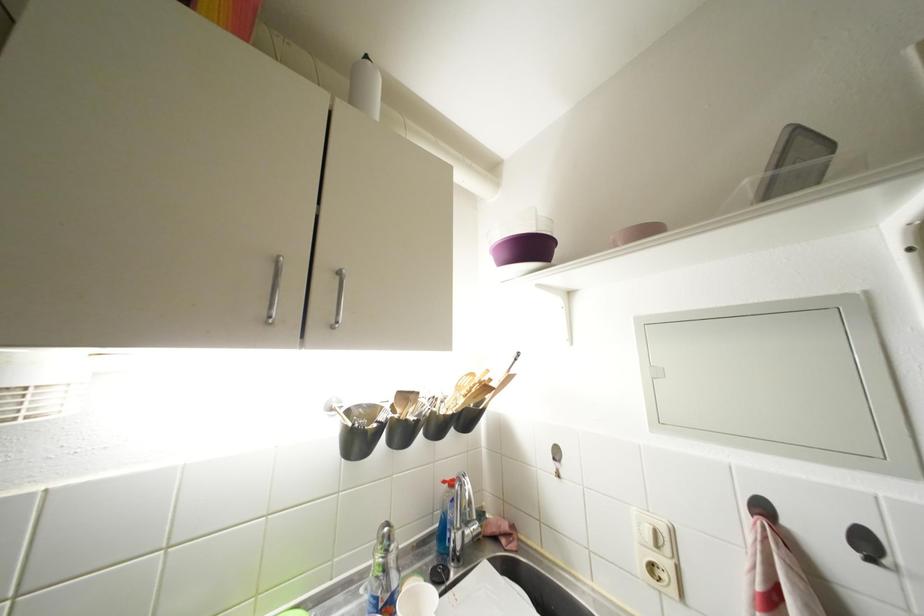
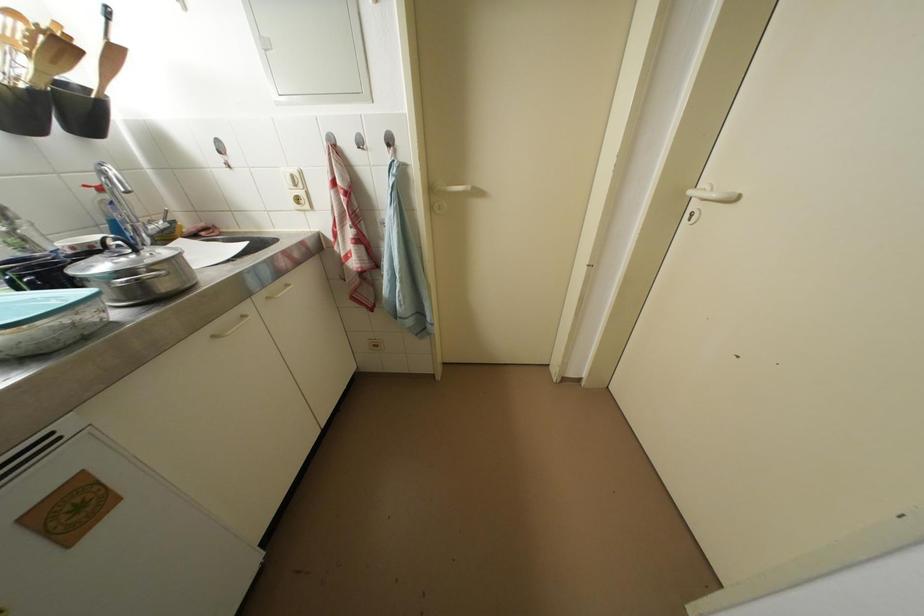
Find the pixel in the second image that matches point (516, 382) in the first image.

(120, 55)